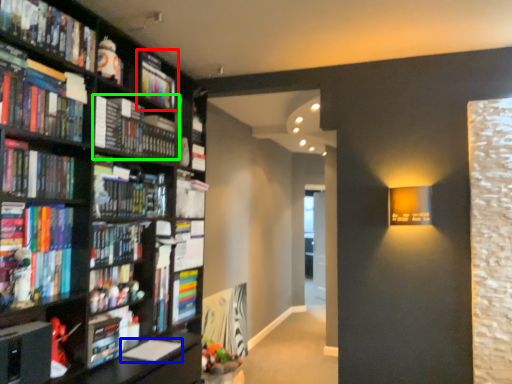
Question: Which object is positioned farthest from book (highlighted by a red box)? Select from paperback book (highlighted by a blue box) and book (highlighted by a green box).

Choices:
 (A) paperback book
 (B) book

Answer: (A)